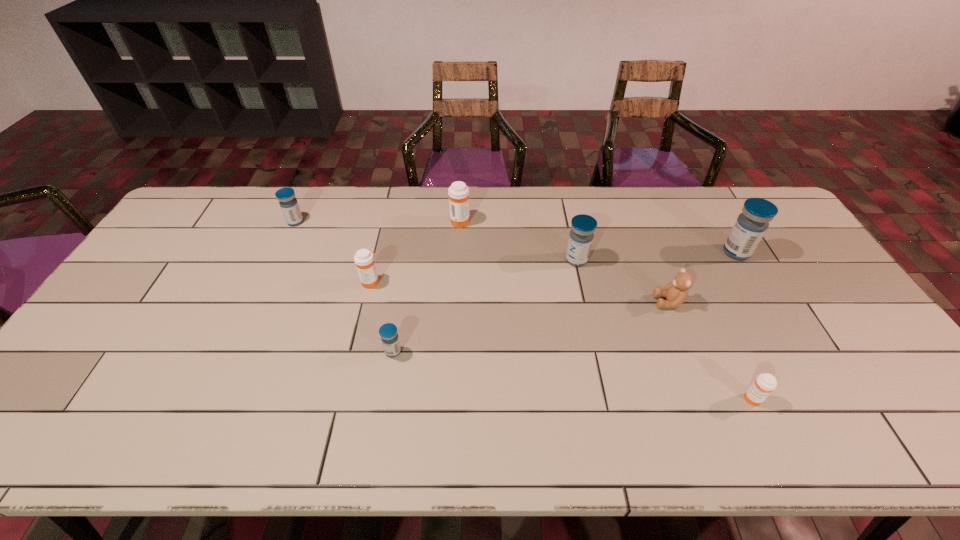
At what (x,y) coordinates should I click in order to perform the action: click on the sixth farthest object. Please return your answer as a coordinate pair (x, y). Looking at the image, I should click on (676, 292).

The height and width of the screenshot is (540, 960). What are the coordinates of `the third object from right to left` in the screenshot? It's located at (676, 292).

This screenshot has width=960, height=540. In order to click on the seventh farthest object in this screenshot , I will do `click(388, 332)`.

You are a GUI agent. You are given a task and a screenshot of the screen. Output one action in this format:
    pyautogui.click(x=<x>, y=<y>)
    Task: Click on the nearest blue medicine
    
    Given the screenshot: What is the action you would take?
    pyautogui.click(x=388, y=332)

The image size is (960, 540). I want to click on the nearest orange medicine, so click(764, 384).

Where is `the seventh object from left to right`? The image size is (960, 540). the seventh object from left to right is located at coordinates coord(764,384).

At what (x,y) coordinates should I click in order to perform the action: click on free space located on the right of the biggest blue medicine. Please return your answer as a coordinate pair (x, y). Looking at the image, I should click on (798, 253).

This screenshot has width=960, height=540. I want to click on free location located on the left of the fifth object from right to left, so click(368, 221).

Find the location of `vacant space located on the left of the fifth medicine from left to right`. vacant space located on the left of the fifth medicine from left to right is located at coordinates (539, 260).

Where is `free point located on the front of the leftmost object`? free point located on the front of the leftmost object is located at coordinates (262, 294).